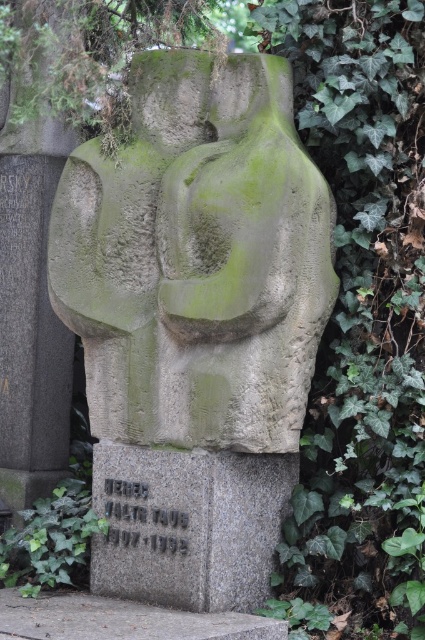
You are an archaeologist examining the scene. You need to determine which stone is wider between the granite stone at center and the green mossy stone at lower left. Based on the description, which one is wider?

The granite stone at center is wider than the green mossy stone at lower left according to the description.

You are standing in a cemetery and see the green mossy stone sculpture at center and the green mossy stone at lower left. Which one is located to the right of the other?

The green mossy stone sculpture at center is positioned on the right side of the green mossy stone at lower left, so the sculpture is to the right of the stone.